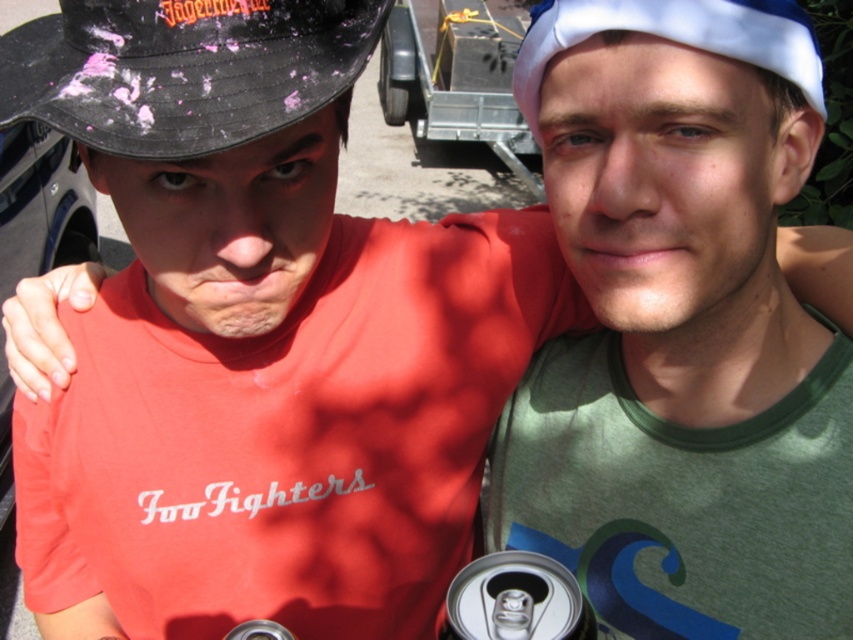
You are a photographer setting up for a group photo. You notice the black matte baseball hat at left and the metallic silver can at lower center. Which object should you adjust to ensure both are in focus, considering their height differences?

The black matte baseball hat at left is taller than the metallic silver can at lower center, so you should lower the camera angle to include the taller hat while still capturing the can within the frame.

You are trying to determine which object is covering another in the image. The black matte baseball hat at left and the silver metallic can at lower center are both visible. Which one is covering the other?

The black matte baseball hat at left is positioned over the silver metallic can at lower center, so it is covering the can.

You are trying to decide which object to pick up first. The white fabric baseball cap at upper right and the silver metallic can at lower center are both within reach. Which one is taller?

The white fabric baseball cap at upper right is taller than the silver metallic can at lower center.